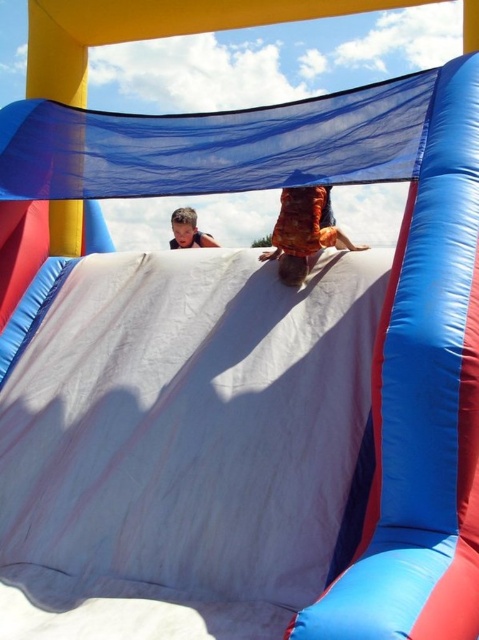
Between blue fabric slide at upper center and light brown hair at upper center, which one appears on the right side from the viewer's perspective?

Positioned to the right is blue fabric slide at upper center.

Which is above, blue fabric slide at upper center or light brown hair at upper center?

light brown hair at upper center is higher up.

Where is `blue fabric slide at upper center`? The height and width of the screenshot is (640, 479). blue fabric slide at upper center is located at coordinates (x=422, y=404).

At what (x,y) coordinates should I click in order to perform the action: click on blue fabric slide at upper center. Please return your answer as a coordinate pair (x, y). This screenshot has height=640, width=479. Looking at the image, I should click on (422, 404).

Which is behind, point (310, 240) or point (197, 232)?

The point (197, 232) is more distant.

This screenshot has height=640, width=479. What do you see at coordinates (304, 230) in the screenshot?
I see `orange cotton shirt at center` at bounding box center [304, 230].

You are a GUI agent. You are given a task and a screenshot of the screen. Output one action in this format:
    pyautogui.click(x=<x>, y=<y>)
    Task: Click on the orange cotton shirt at center
    This screenshot has width=479, height=640.
    Given the screenshot: What is the action you would take?
    pyautogui.click(x=304, y=230)

Is point (387, 368) behind point (296, 193)?

No, it is not.

Who is positioned more to the left, blue fabric slide at upper center or orange cotton shirt at center?

orange cotton shirt at center

Which is in front, point (413, 508) or point (322, 202)?

Point (413, 508) is more forward.

Where is `blue fabric slide at upper center`? The width and height of the screenshot is (479, 640). blue fabric slide at upper center is located at coordinates (422, 404).